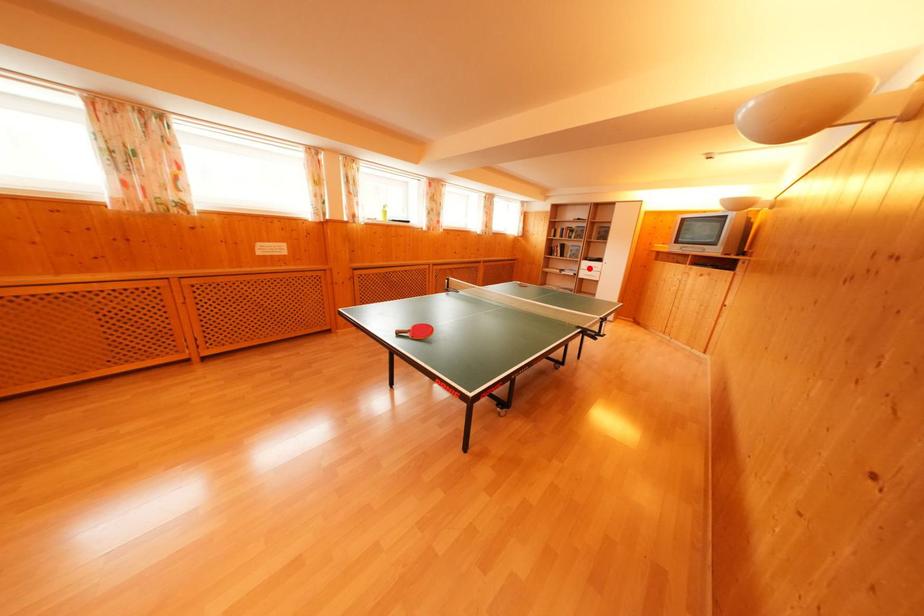
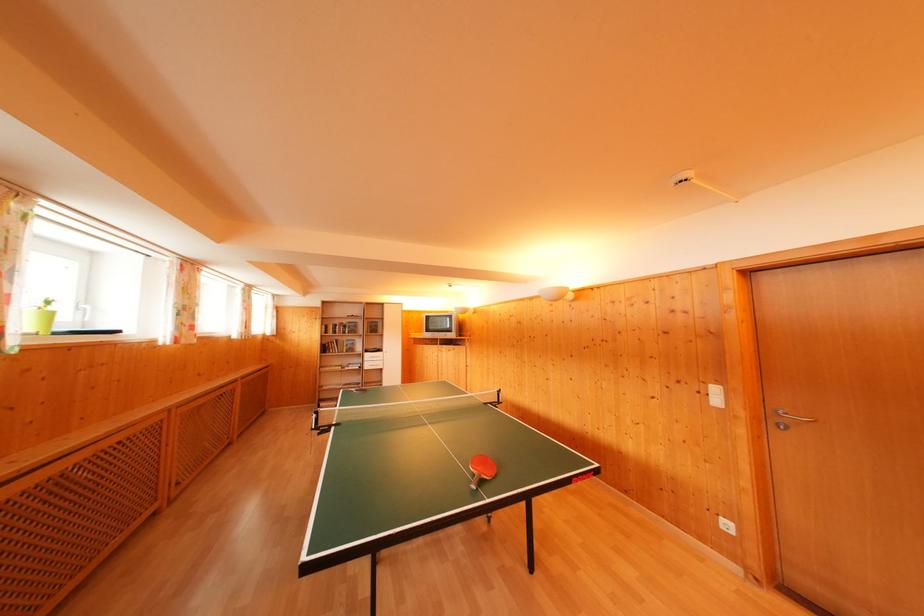
Find the pixel in the second image that matches the highlighted location in the first image.

(371, 360)